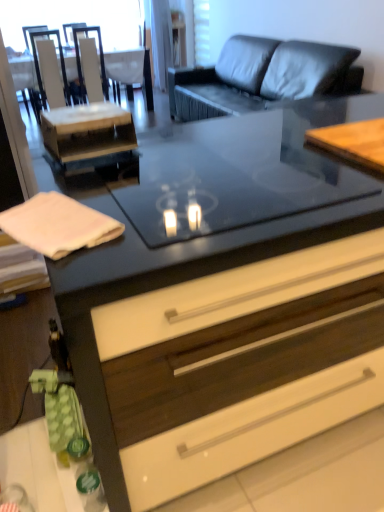
Question: From a real-world perspective, is white glossy armchair at upper left, the first armchair when ordered from left to right, positioned above or below matte black drawer at center?

Choices:
 (A) above
 (B) below

Answer: (A)

Question: Is white glossy armchair at upper left, which ranks as the 3th armchair in right-to-left order, spatially inside matte black drawer at center, or outside of it?

Choices:
 (A) inside
 (B) outside

Answer: (B)

Question: Which object is the closest to the wooden table at upper right?

Choices:
 (A) white fabric armchair at upper center, which is counted as the 3th armchair, starting from the left
 (B) white glossy armchair at upper left, the first armchair when ordered from left to right
 (C) matte black drawer at center
 (D) white wood desk at left
 (E) wooden at left

Answer: (C)

Question: Which of these objects is positioned closest to the wooden at left?

Choices:
 (A) wooden table at upper right
 (B) white fabric armchair at upper center, which is counted as the 3th armchair, starting from the left
 (C) white glossy armchair at upper left, the first armchair when ordered from left to right
 (D) white wood desk at left
 (E) matte black drawer at center

Answer: (C)